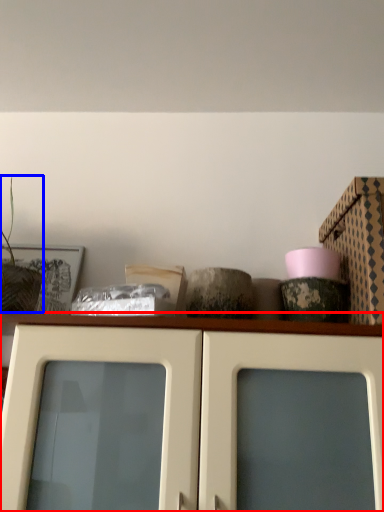
Question: Which of the following is the closest to the observer, cabinetry (highlighted by a red box) or plant (highlighted by a blue box)?

Choices:
 (A) cabinetry
 (B) plant

Answer: (A)